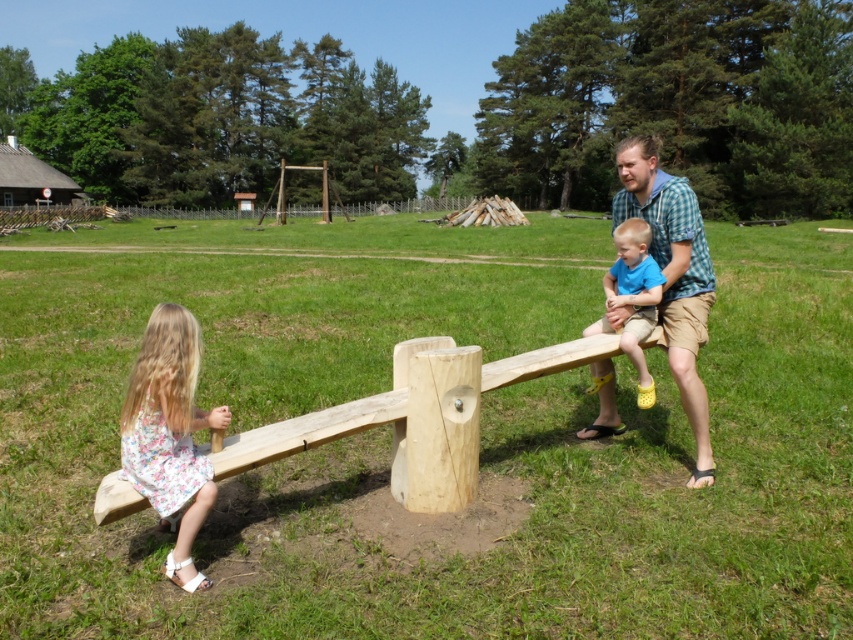
Is checkered fabric shirt at right above blue cotton shirt at right?

Indeed, checkered fabric shirt at right is positioned over blue cotton shirt at right.

Which is more to the right, checkered fabric shirt at right or blue cotton shirt at right?

checkered fabric shirt at right is more to the right.

Find the location of `checkered fabric shirt at right`. checkered fabric shirt at right is located at coordinates (x=672, y=275).

Does floral fabric dress at left have a larger size compared to checkered fabric shirt at right?

Actually, floral fabric dress at left might be smaller than checkered fabric shirt at right.

Locate an element on the screen. This screenshot has height=640, width=853. floral fabric dress at left is located at coordinates (170, 435).

Identify the location of floral fabric dress at left. (170, 435).

Where is `floral fabric dress at left`? floral fabric dress at left is located at coordinates (170, 435).

Measure the distance between floral fabric dress at left and blue cotton shirt at right.

floral fabric dress at left and blue cotton shirt at right are 8.43 feet apart from each other.

Find the location of a particular element. floral fabric dress at left is located at coordinates (170, 435).